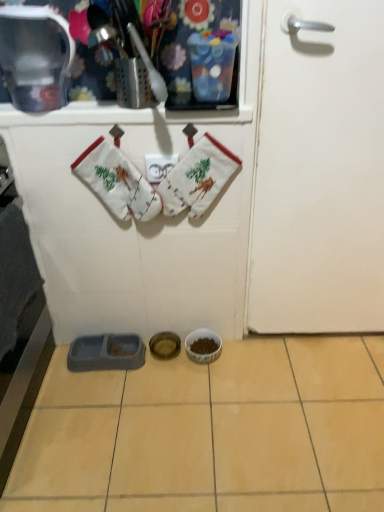
At what (x,y) coordinates should I click in order to perform the action: click on vacant point above white cotton oven mitts at center, acting as the 1th baby clothe starting from the right (from a real-world perspective). Please return your answer as a coordinate pair (x, y). The width and height of the screenshot is (384, 512). Looking at the image, I should click on (193, 129).